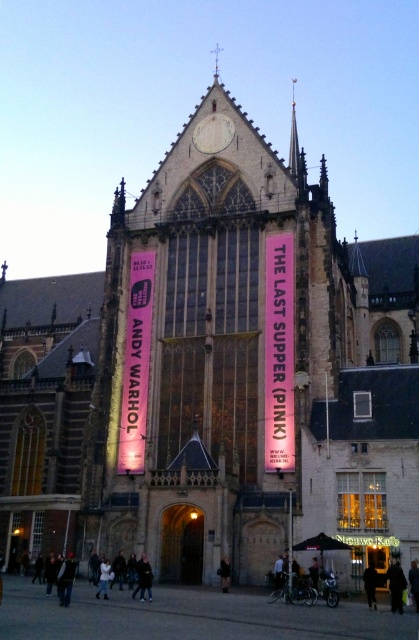
Who is more forward, (390,573) or (416,602)?

Point (416,602)

Is dark gray jacket at lower right thinner than black fabric person at lower right?

No.

Between point (388, 568) and point (408, 570), which one is positioned behind?

The point (408, 570) is behind.

Where is `dark gray jacket at lower right`? Image resolution: width=419 pixels, height=640 pixels. dark gray jacket at lower right is located at coordinates (395, 586).

Is matte gray clock at upper center below black matte person at lower right?

Incorrect, matte gray clock at upper center is not positioned below black matte person at lower right.

Based on the photo, can you confirm if matte gray clock at upper center is positioned to the right of black matte person at lower right?

In fact, matte gray clock at upper center is to the left of black matte person at lower right.

What do you see at coordinates (212, 132) in the screenshot? Image resolution: width=419 pixels, height=640 pixels. I see `matte gray clock at upper center` at bounding box center [212, 132].

Where is `matte gray clock at upper center`? The height and width of the screenshot is (640, 419). matte gray clock at upper center is located at coordinates (212, 132).

Is dark gray jacket at lower right thinner than black leather jacket at lower center?

In fact, dark gray jacket at lower right might be wider than black leather jacket at lower center.

Which is below, dark gray jacket at lower right or black leather jacket at lower center?

black leather jacket at lower center

Is point (390, 608) more distant than point (227, 580)?

No.

The height and width of the screenshot is (640, 419). I want to click on dark gray jacket at lower right, so click(x=395, y=586).